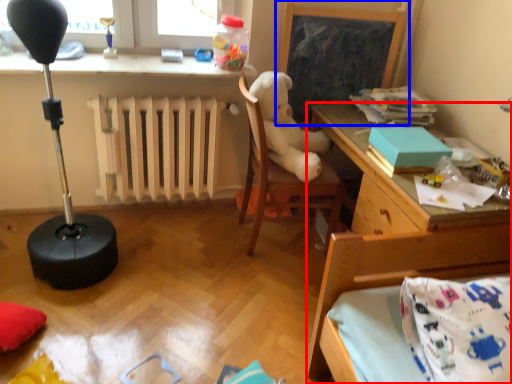
Question: Which object is closer to the camera taking this photo, desk (highlighted by a red box) or bulletin board (highlighted by a blue box)?

Choices:
 (A) desk
 (B) bulletin board

Answer: (A)